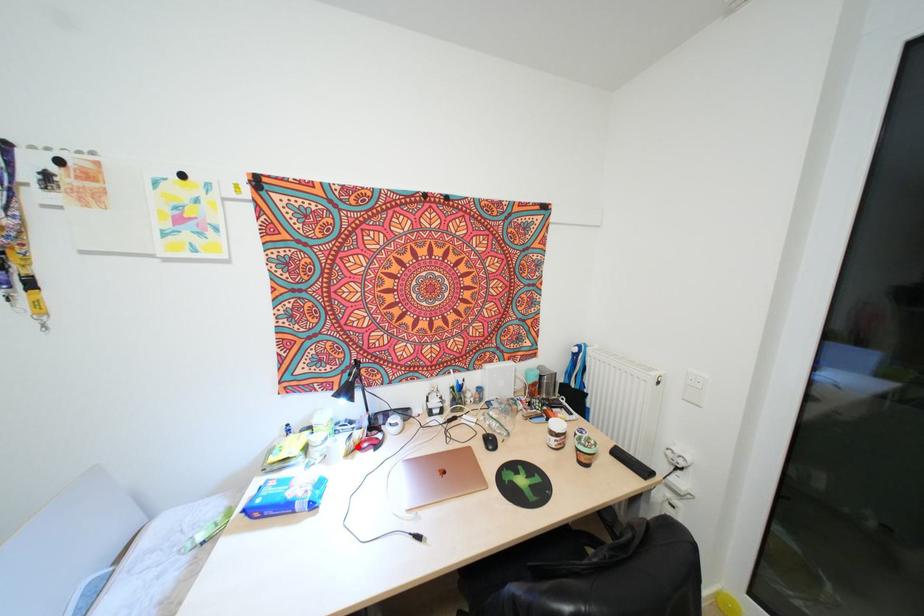
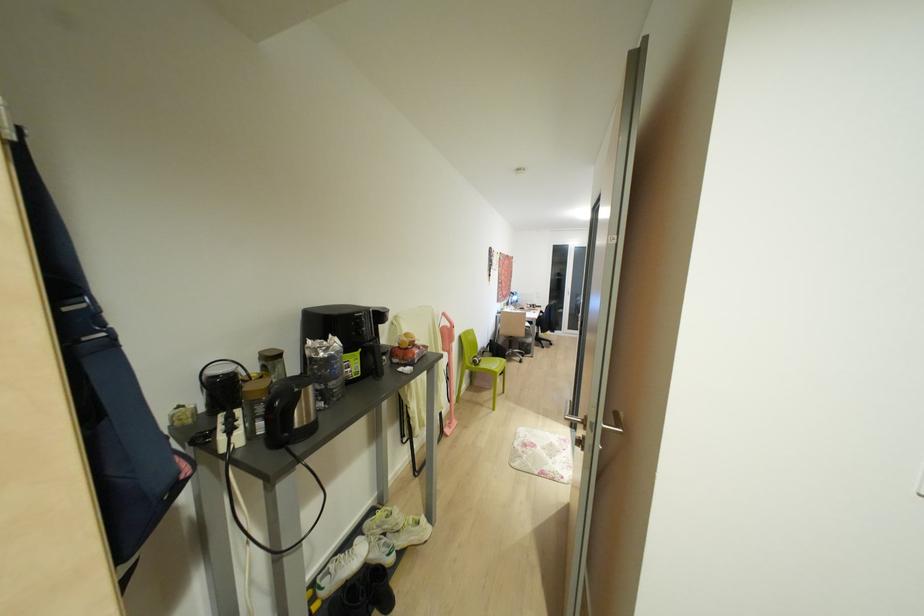
Question: I am providing you with two images of the same scene from different viewpoints. A red point is marked on the first image. Can you still see the location of the red point in image 2?

Choices:
 (A) Yes
 (B) No

Answer: (B)